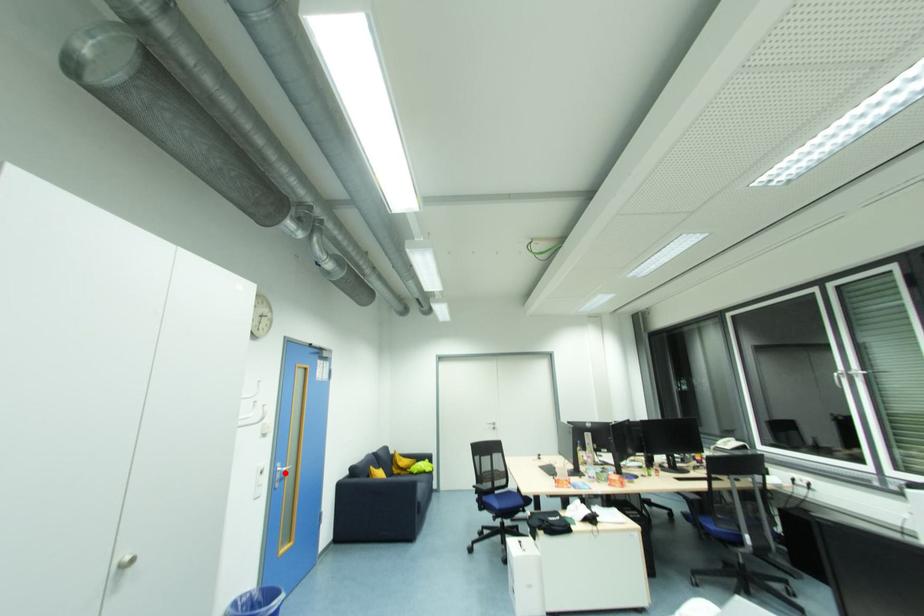
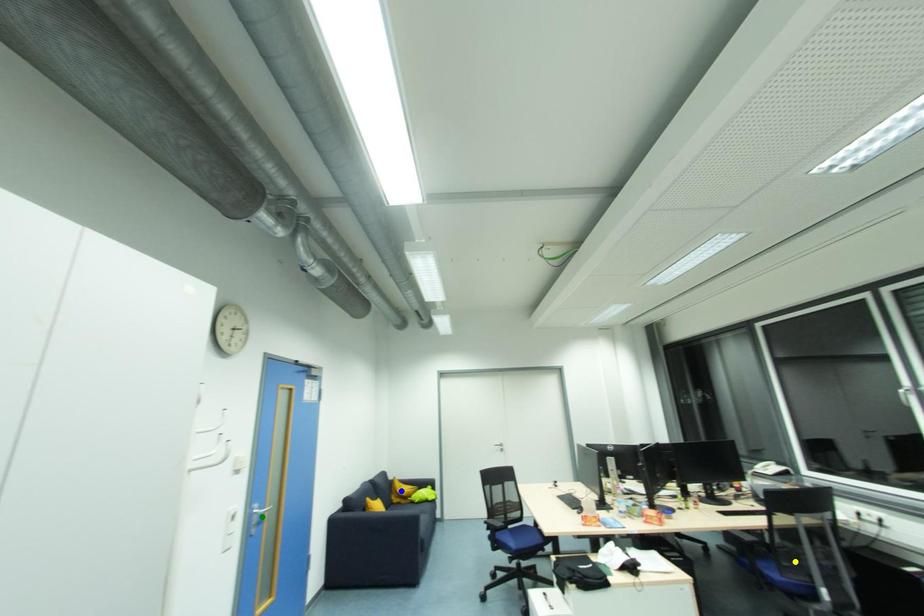
Question: I am providing you with two images of the same scene from different viewpoints. A red point is marked on the first image. You are given multiple points on the second image. Which point in image 2 is actually the same real-world point as the red point in image 1?

Choices:
 (A) blue point
 (B) green point
 (C) yellow point

Answer: (B)